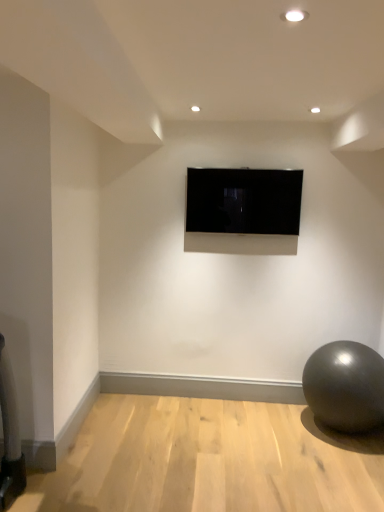
Question: Should I look upward or downward to see shiny metallic ball at lower right?

Choices:
 (A) up
 (B) down

Answer: (B)

Question: Is the depth of shiny metallic ball at lower right greater than that of black glossy tv at center?

Choices:
 (A) yes
 (B) no

Answer: (B)

Question: Is shiny metallic ball at lower right to the left of black glossy tv at center from the viewer's perspective?

Choices:
 (A) yes
 (B) no

Answer: (B)

Question: Is shiny metallic ball at lower right positioned before black glossy tv at center?

Choices:
 (A) yes
 (B) no

Answer: (A)

Question: Are shiny metallic ball at lower right and black glossy tv at center far apart?

Choices:
 (A) yes
 (B) no

Answer: (A)

Question: Does shiny metallic ball at lower right have a lesser width compared to black glossy tv at center?

Choices:
 (A) no
 (B) yes

Answer: (A)

Question: Is shiny metallic ball at lower right beside black glossy tv at center?

Choices:
 (A) no
 (B) yes

Answer: (A)

Question: Is black glossy tv at center looking in the opposite direction of shiny metallic ball at lower right?

Choices:
 (A) no
 (B) yes

Answer: (A)

Question: Is black glossy tv at center not close to shiny metallic ball at lower right?

Choices:
 (A) yes
 (B) no

Answer: (A)

Question: Can you confirm if black glossy tv at center is positioned to the left of shiny metallic ball at lower right?

Choices:
 (A) no
 (B) yes

Answer: (B)

Question: From the image's perspective, is black glossy tv at center below shiny metallic ball at lower right?

Choices:
 (A) no
 (B) yes

Answer: (A)

Question: Can you confirm if black glossy tv at center is smaller than shiny metallic ball at lower right?

Choices:
 (A) yes
 (B) no

Answer: (A)

Question: Is black glossy tv at center shorter than shiny metallic ball at lower right?

Choices:
 (A) no
 (B) yes

Answer: (B)

Question: Would you say black glossy tv at center is to the left or to the right of shiny metallic ball at lower right in the picture?

Choices:
 (A) right
 (B) left

Answer: (B)